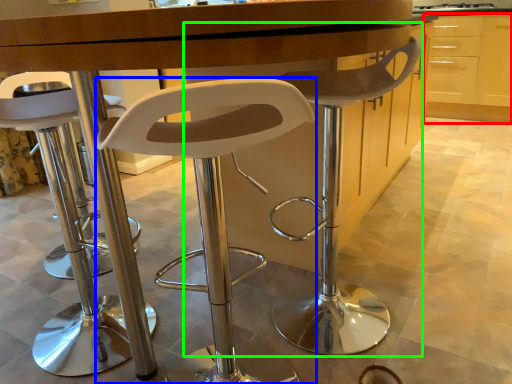
Question: Which object is the closest to the cabinetry (highlighted by a red box)? Choose among these: chair (highlighted by a blue box) or chair (highlighted by a green box).

Choices:
 (A) chair
 (B) chair

Answer: (B)